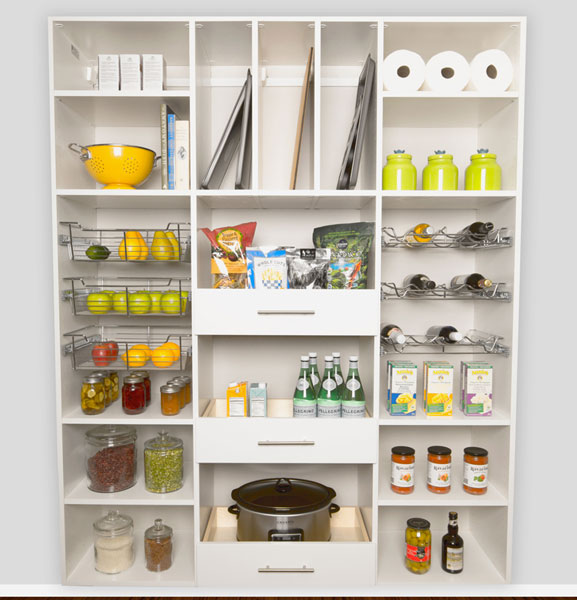
Identify the location of front of shelves edge. This screenshot has width=577, height=600. (82, 93), (85, 190), (104, 421), (102, 503), (424, 503), (448, 421), (457, 192), (295, 192), (424, 93).